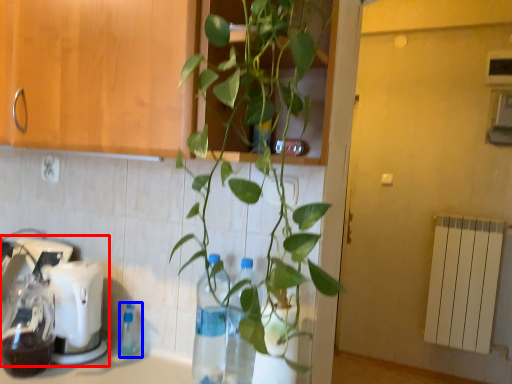
Question: Which object appears farthest to the camera in this image, mixer (highlighted by a red box) or bottle (highlighted by a blue box)?

Choices:
 (A) mixer
 (B) bottle

Answer: (B)